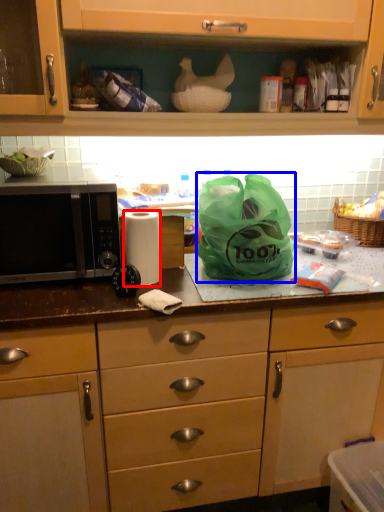
Question: Which object appears closest to the camera in this image, paper towel (highlighted by a red box) or plastic bag (highlighted by a blue box)?

Choices:
 (A) paper towel
 (B) plastic bag

Answer: (B)